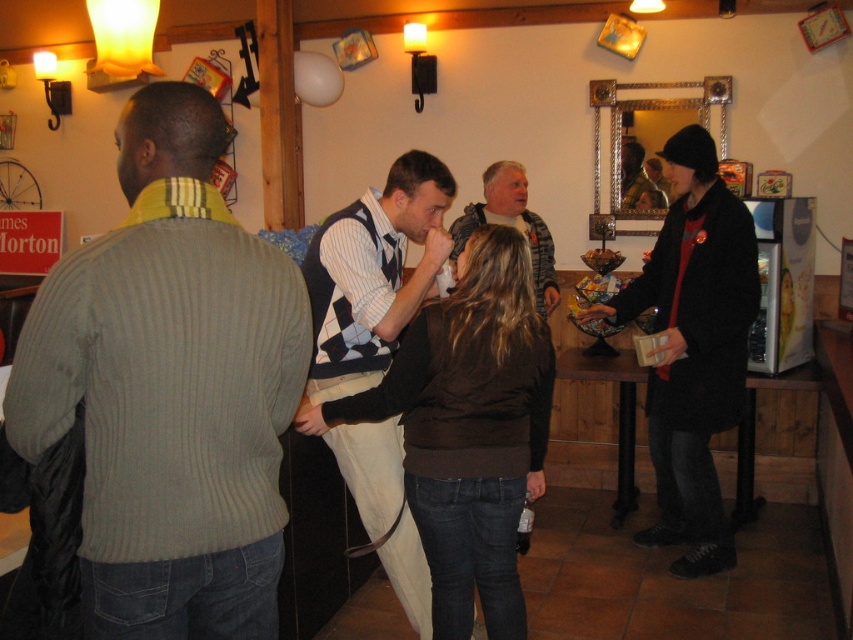
Which is behind, point (126, 419) or point (474, 410)?

The point (474, 410) is behind.

Does ribbed sweater at left appear on the right side of brown sweater at center?

In fact, ribbed sweater at left is to the left of brown sweater at center.

Who is more distant from viewer, (x=187, y=545) or (x=520, y=426)?

Positioned behind is point (x=520, y=426).

Identify the location of ribbed sweater at left. (169, 388).

Is point (676, 476) closer to camera compared to point (489, 177)?

Yes, it is.

Can you confirm if dark gray wool coat at right is positioned above gray sweater at center?

Incorrect, dark gray wool coat at right is not positioned above gray sweater at center.

Image resolution: width=853 pixels, height=640 pixels. I want to click on dark gray wool coat at right, so click(x=693, y=348).

Image resolution: width=853 pixels, height=640 pixels. Identify the location of dark gray wool coat at right. (693, 348).

Can you confirm if ribbed sweater at left is bigger than dark gray wool coat at right?

Actually, ribbed sweater at left might be smaller than dark gray wool coat at right.

Does ribbed sweater at left appear under dark gray wool coat at right?

No.

The image size is (853, 640). Describe the element at coordinates (169, 388) in the screenshot. I see `ribbed sweater at left` at that location.

Identify the location of ribbed sweater at left. (169, 388).